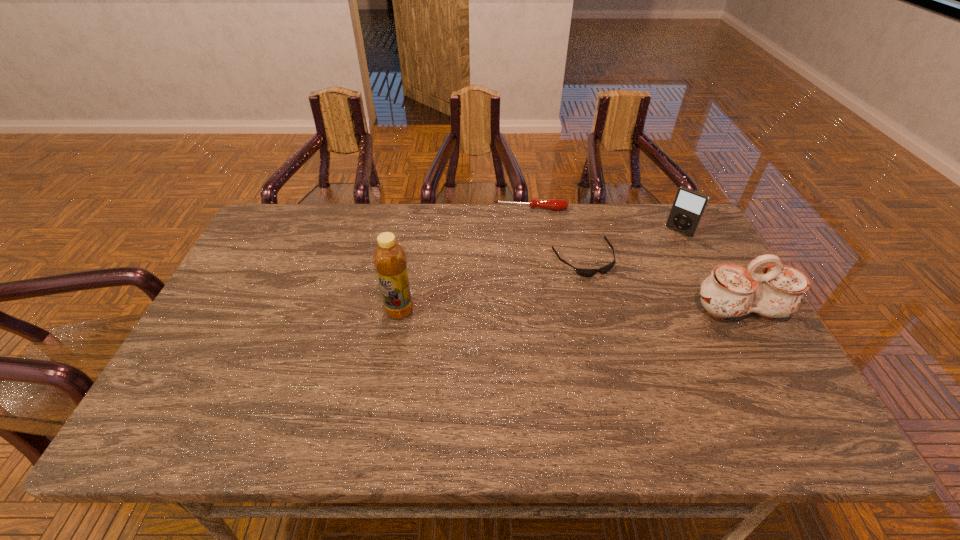
This screenshot has height=540, width=960. What are the coordinates of `free space between the third shortest object and the screwdriver` in the screenshot? It's located at (605, 220).

This screenshot has width=960, height=540. Identify the location of free space between the chinaware and the shortest object. click(x=661, y=285).

In order to click on object that is the third closest to the chinaware in this screenshot , I will do `click(552, 204)`.

This screenshot has height=540, width=960. Find the location of `the second closest object relative to the second farthest object`. the second closest object relative to the second farthest object is located at coordinates (730, 291).

This screenshot has height=540, width=960. I want to click on vacant area that satisfies the following two spatial constraints: 1. on the front side of the iPod; 2. on the left side of the farthest object, so click(534, 232).

This screenshot has width=960, height=540. What are the coordinates of `free space that satisfies the following two spatial constraints: 1. on the back side of the sunglasses; 2. on the left side of the third tallest object` in the screenshot? It's located at (576, 232).